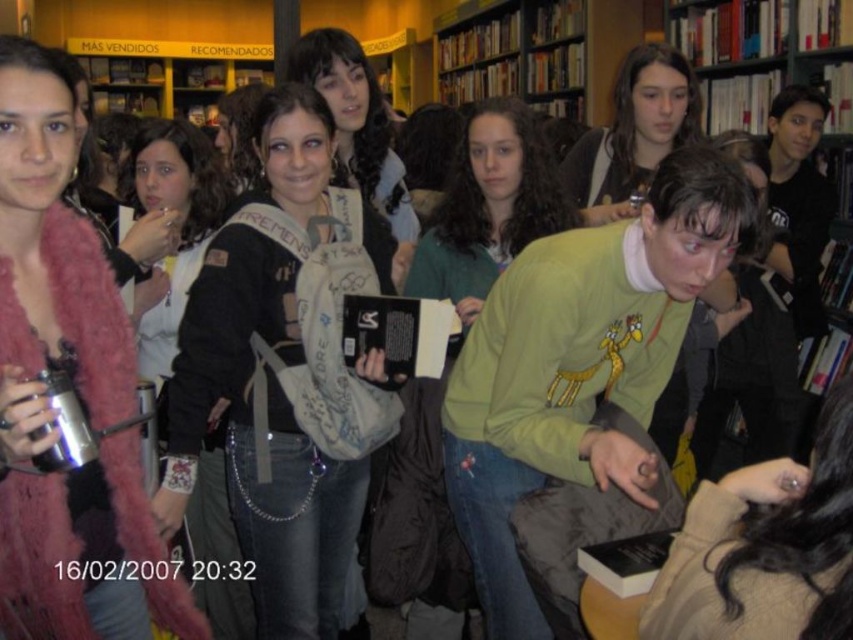
Which of these two, green matte sweater at center or black leather jacket at center, stands taller?

Standing taller between the two is black leather jacket at center.

Find the location of a particular element. green matte sweater at center is located at coordinates (579, 362).

The height and width of the screenshot is (640, 853). What do you see at coordinates (579, 362) in the screenshot?
I see `green matte sweater at center` at bounding box center [579, 362].

Find the location of a particular element. The height and width of the screenshot is (640, 853). green matte sweater at center is located at coordinates (579, 362).

Who is taller, fuzzy pink coat at upper left or green matte shirt at center?

With more height is green matte shirt at center.

Which of these two, fuzzy pink coat at upper left or green matte shirt at center, stands shorter?

fuzzy pink coat at upper left is shorter.

Which is behind, point (0, 426) or point (466, 124)?

The point (466, 124) is behind.

Image resolution: width=853 pixels, height=640 pixels. Identify the location of fuzzy pink coat at upper left. (74, 387).

Looking at this image, does fuzzy pink coat at upper left have a lesser height compared to matte green sweater at center?

In fact, fuzzy pink coat at upper left may be taller than matte green sweater at center.

Who is lower down, fuzzy pink coat at upper left or matte green sweater at center?

fuzzy pink coat at upper left is below.

Is point (16, 420) positioned in front of point (608, 180)?

Yes.

This screenshot has width=853, height=640. In order to click on fuzzy pink coat at upper left in this screenshot , I will do `click(74, 387)`.